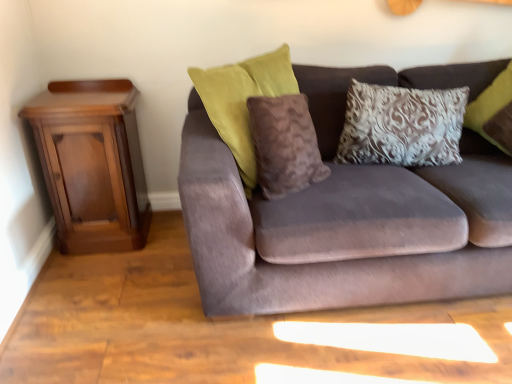
Question: From the image's perspective, is mahogany wood nightstand at left under silver textured pillow at upper right, which is the first pillow from right to left?

Choices:
 (A) yes
 (B) no

Answer: (A)

Question: From the image's perspective, is mahogany wood nightstand at left on silver textured pillow at upper right, the 2th pillow from the left?

Choices:
 (A) no
 (B) yes

Answer: (A)

Question: From a real-world perspective, is mahogany wood nightstand at left below silver textured pillow at upper right, which is the first pillow from right to left?

Choices:
 (A) yes
 (B) no

Answer: (A)

Question: Considering the relative positions of mahogany wood nightstand at left and silver textured pillow at upper right, which is the first pillow from right to left, in the image provided, is mahogany wood nightstand at left to the right of silver textured pillow at upper right, which is the first pillow from right to left, from the viewer's perspective?

Choices:
 (A) yes
 (B) no

Answer: (B)

Question: Is mahogany wood nightstand at left far away from silver textured pillow at upper right, which is the first pillow from right to left?

Choices:
 (A) yes
 (B) no

Answer: (A)

Question: Does mahogany wood nightstand at left have a lesser height compared to silver textured pillow at upper right, which is the first pillow from right to left?

Choices:
 (A) no
 (B) yes

Answer: (A)

Question: Can we say silver textured pillow at upper right, the 2th pillow from the left, lies outside mahogany wood nightstand at left?

Choices:
 (A) no
 (B) yes

Answer: (B)

Question: Is silver textured pillow at upper right, the 2th pillow from the left, next to mahogany wood nightstand at left and touching it?

Choices:
 (A) yes
 (B) no

Answer: (B)

Question: Can you confirm if silver textured pillow at upper right, which is the first pillow from right to left, is wider than mahogany wood nightstand at left?

Choices:
 (A) no
 (B) yes

Answer: (A)

Question: Is the position of silver textured pillow at upper right, which is the first pillow from right to left, more distant than that of mahogany wood nightstand at left?

Choices:
 (A) no
 (B) yes

Answer: (B)

Question: Can you confirm if silver textured pillow at upper right, which is the first pillow from right to left, is thinner than mahogany wood nightstand at left?

Choices:
 (A) no
 (B) yes

Answer: (B)

Question: Considering the relative positions of silver textured pillow at upper right, the 2th pillow from the left, and mahogany wood nightstand at left in the image provided, is silver textured pillow at upper right, the 2th pillow from the left, to the left of mahogany wood nightstand at left from the viewer's perspective?

Choices:
 (A) no
 (B) yes

Answer: (A)

Question: From a real-world perspective, is velvet brown couch at center under mahogany wood nightstand at left?

Choices:
 (A) yes
 (B) no

Answer: (B)